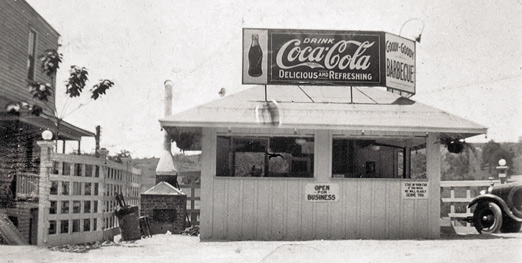
Identify the location of brick fireplace. (167, 201).